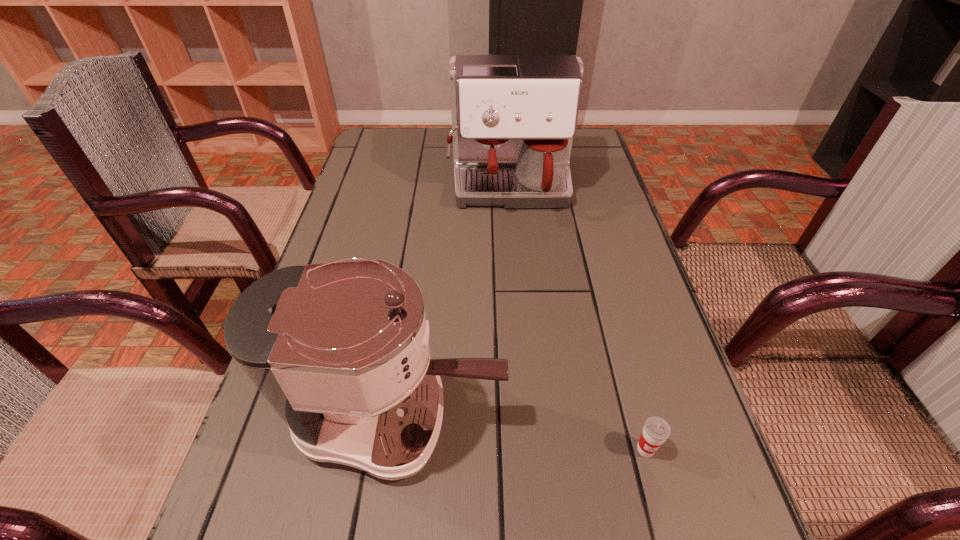
Find the location of a particular element. the farther coffee maker is located at coordinates (514, 117).

The image size is (960, 540). What are the coordinates of `the nearer coffee maker` in the screenshot? It's located at (340, 350).

This screenshot has width=960, height=540. In order to click on cup in this screenshot , I will do [x=656, y=430].

Where is `vacant space located 0.110m on the front of the farther coffee maker near the spout`? The height and width of the screenshot is (540, 960). vacant space located 0.110m on the front of the farther coffee maker near the spout is located at coordinates (515, 254).

Identify the location of free region located 0.140m on the front-facing side of the nearer coffee maker. The image size is (960, 540). (588, 418).

Locate an element on the screen. object present at the far edge is located at coordinates (514, 117).

Locate an element on the screen. object located in the left edge section of the desktop is located at coordinates (340, 350).

Find the location of a particular element. coffee maker present at the right edge is located at coordinates (514, 117).

You are a GUI agent. You are given a task and a screenshot of the screen. Output one action in this format:
    pyautogui.click(x=<x>, y=<y>)
    Task: Click on the cup situated at the right edge
    This screenshot has width=960, height=540.
    Given the screenshot: What is the action you would take?
    pyautogui.click(x=656, y=430)

The image size is (960, 540). I want to click on object that is at the far right corner, so click(514, 117).